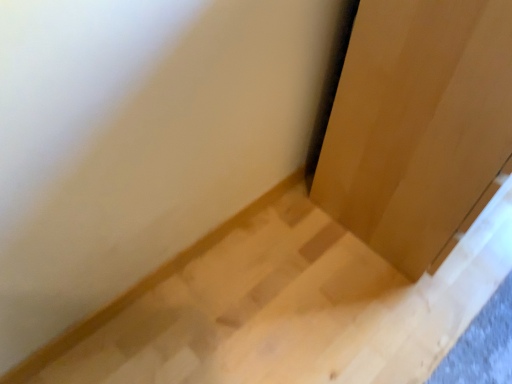
What are the coordinates of `matte wood door at right` in the screenshot? It's located at (417, 123).

What do you see at coordinates (417, 123) in the screenshot?
I see `matte wood door at right` at bounding box center [417, 123].

This screenshot has height=384, width=512. I want to click on matte wood door at right, so click(x=417, y=123).